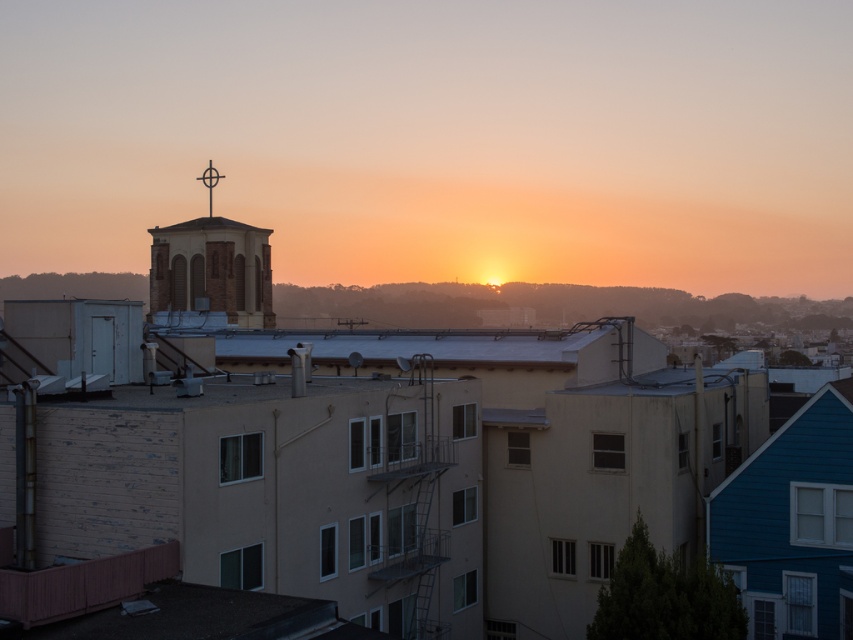
You are an architect analyzing the urban sunset scene. You notice the brick steeple at upper center and the metallic cross at upper center. Based on their positions, which object is likely to cast a longer shadow on the ground?

The brick steeple at upper center is wider than the metallic cross at upper center, so it will cast a longer shadow on the ground.

You are standing at the point labeled as point (212, 266) in the image. What structure are you directly at?

The point (212, 266) indicates the brick steeple at upper center, so you are directly at the brick steeple at upper center.